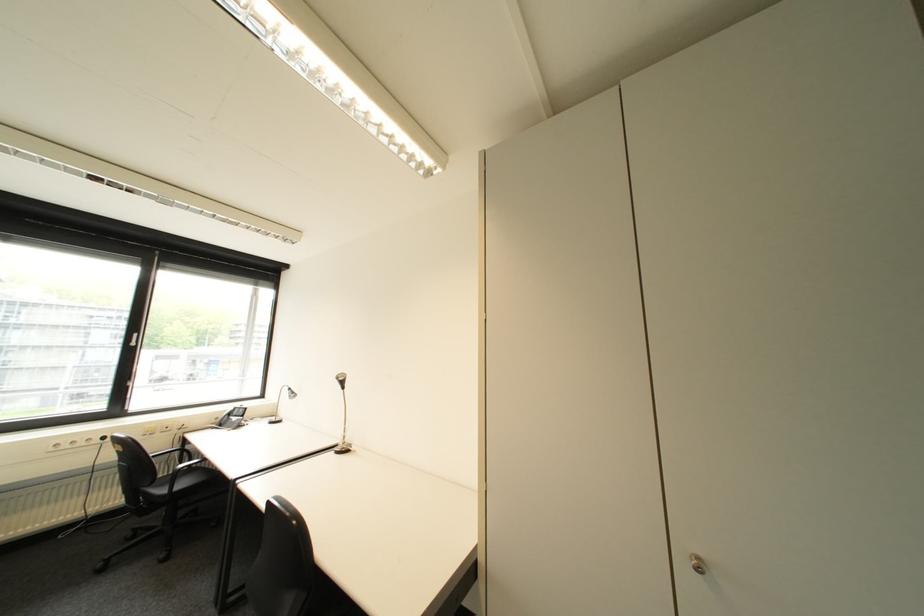
Find the location of `metal cabinet lock`. metal cabinet lock is located at coordinates (697, 564).